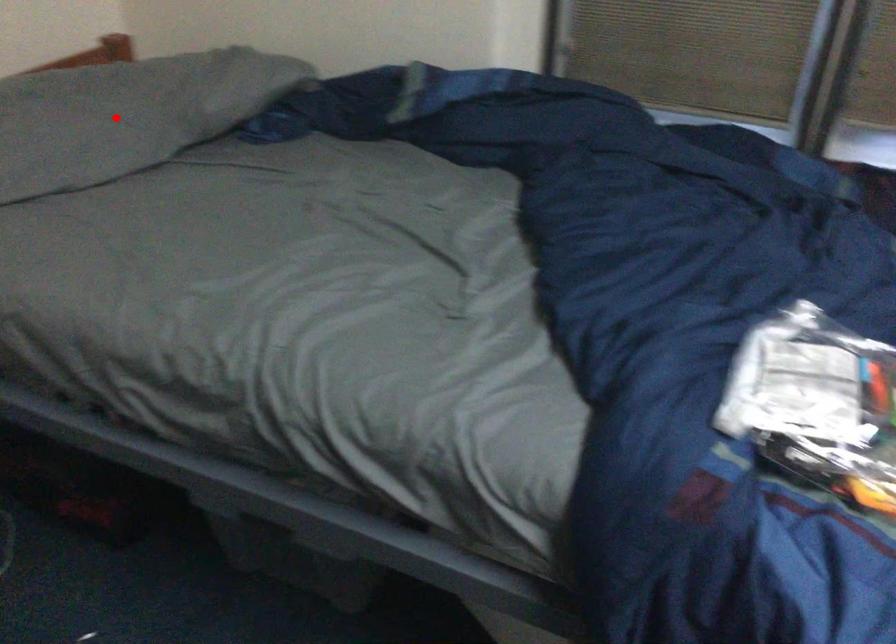
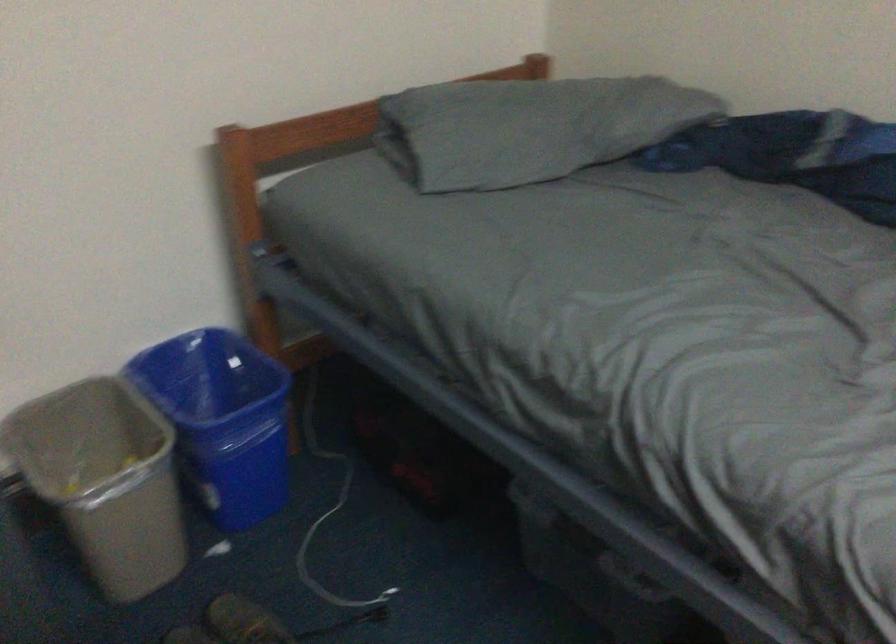
Find the pixel in the second image that matches the highlighted location in the first image.

(529, 128)